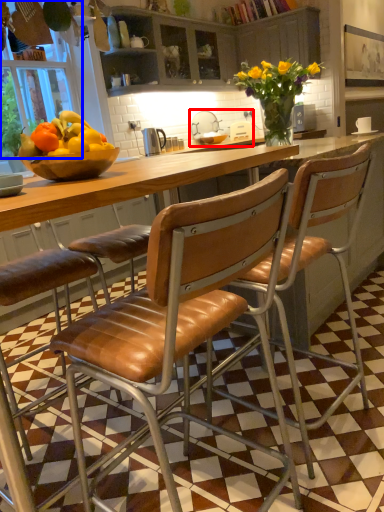
Question: Among these objects, which one is nearest to the camera, sink (highlighted by a red box) or window screen (highlighted by a blue box)?

Choices:
 (A) sink
 (B) window screen

Answer: (B)